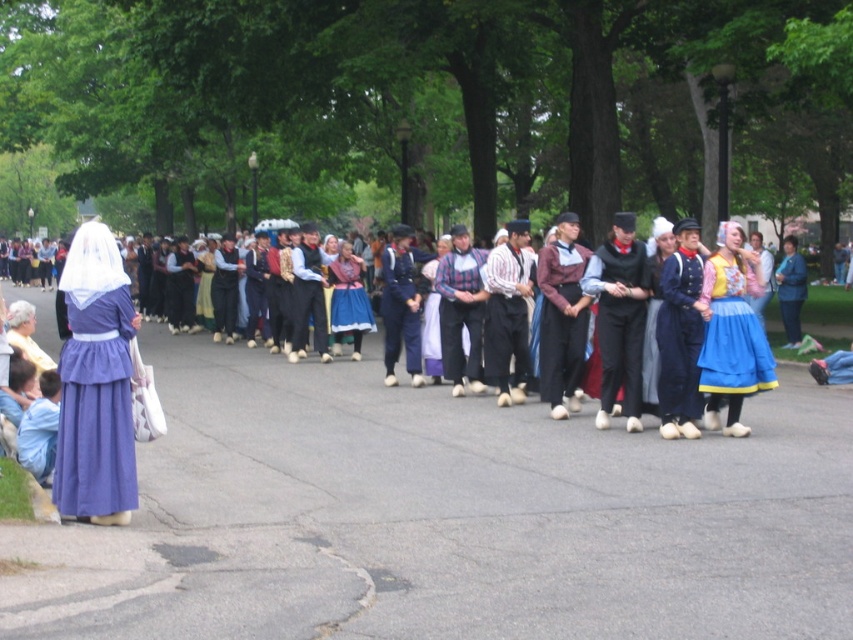
Can you confirm if maroon fabric shirt at center is wider than plaid fabric shirt at center?

Yes, maroon fabric shirt at center is wider than plaid fabric shirt at center.

Between point (556, 260) and point (476, 365), which one is positioned in front?

Point (556, 260)

Is point (561, 300) farther from viewer compared to point (440, 282)?

No, (561, 300) is in front of (440, 282).

Identify the location of maroon fabric shirt at center. (561, 316).

Does matte white shirt at center appear over matte black vest at center?

No.

Does matte white shirt at center have a larger size compared to matte black vest at center?

Correct, matte white shirt at center is larger in size than matte black vest at center.

Is point (309, 244) farther from camera compared to point (219, 296)?

That is False.

What are the coordinates of `matte white shirt at center` in the screenshot? It's located at coord(308,294).

Can you confirm if blue denim pants at center is positioned above matte yellow dress at center?

Actually, blue denim pants at center is below matte yellow dress at center.

The height and width of the screenshot is (640, 853). Identify the location of blue denim pants at center. (401, 305).

Where is `blue denim pants at center`? blue denim pants at center is located at coordinates (401, 305).